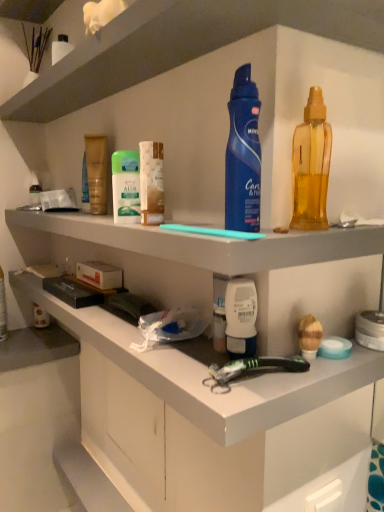
The width and height of the screenshot is (384, 512). What are the coordinates of `vacant space that is to the left of white plastic toothpaste tube at center, which is the first toiletry in front-to-back order` in the screenshot? It's located at (165, 355).